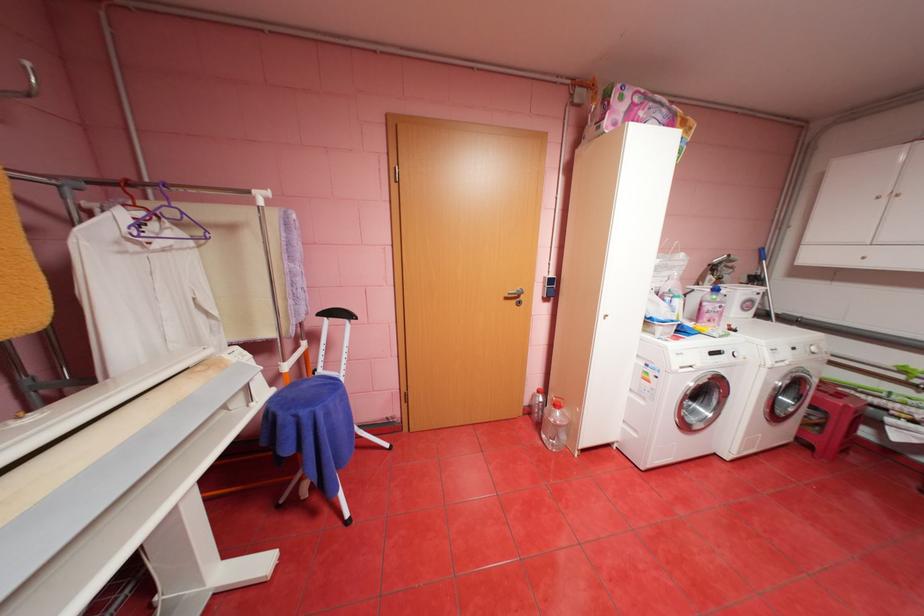
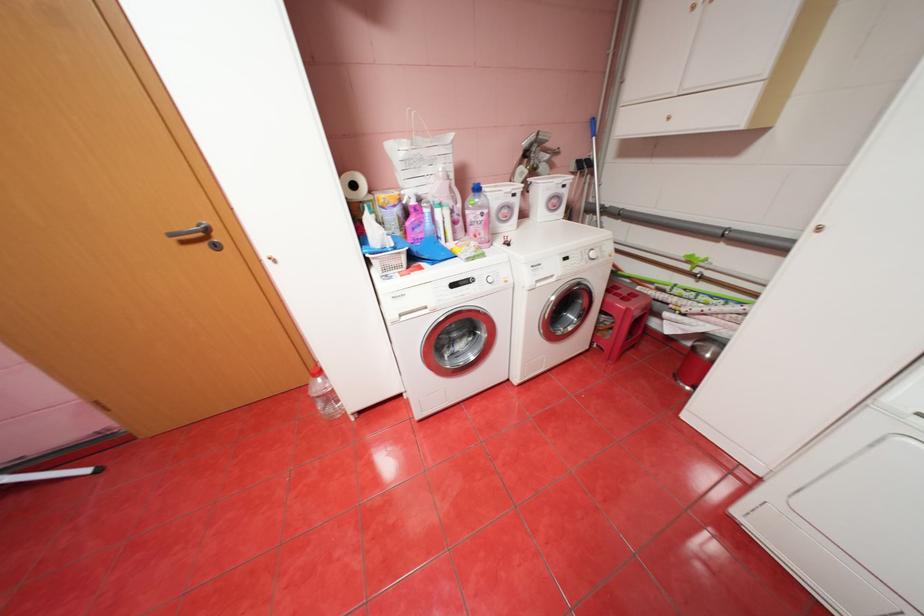
Question: What movement of the cameraman would produce the second image?

Choices:
 (A) Left
 (B) Right
 (C) Forward
 (D) Backward

Answer: (B)